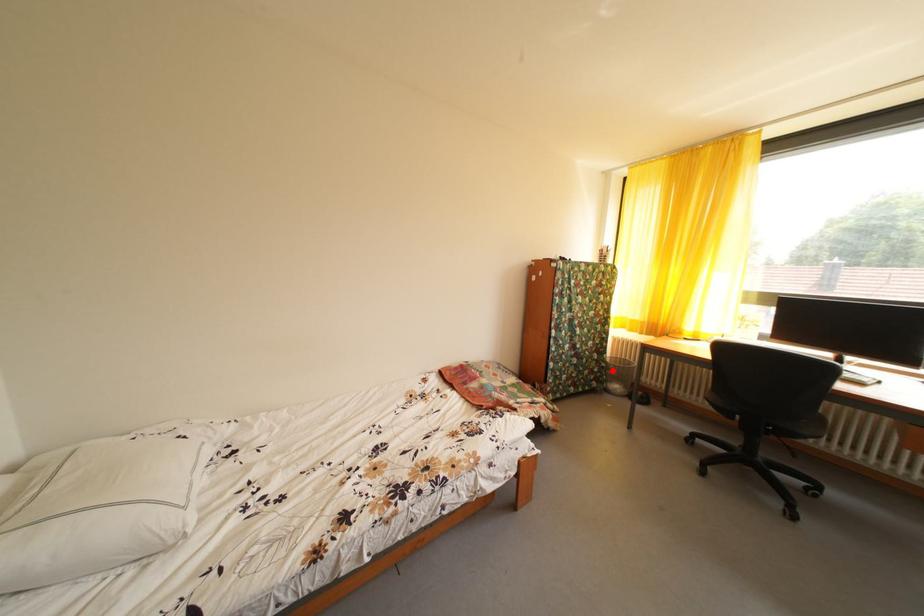
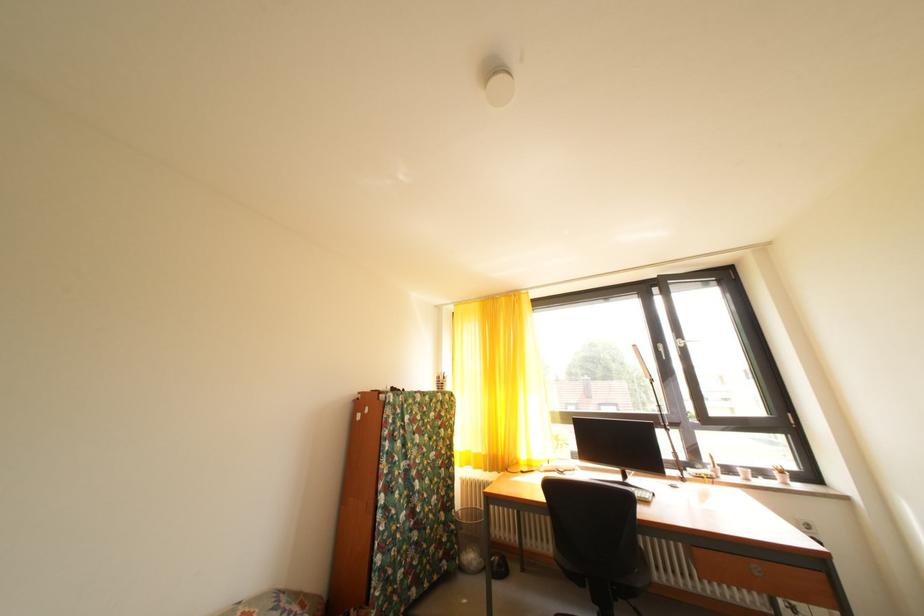
Find the pixel in the second image that matches the highlighted location in the first image.

(462, 533)